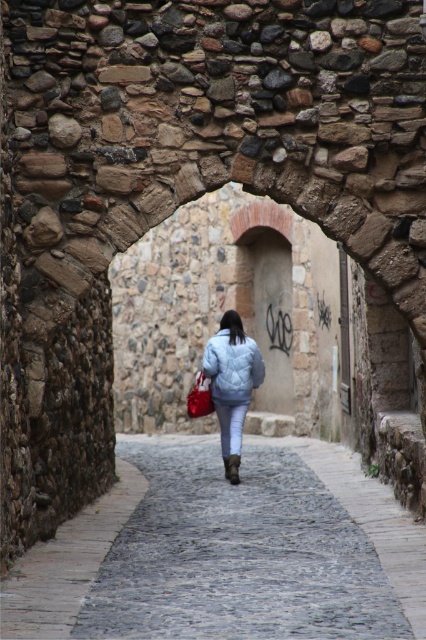
Between point (226, 340) and point (198, 403), which one is positioned behind?

The point (198, 403) is more distant.

Does matte blue jacket at center have a lesser width compared to matte red shopping bag at center?

Incorrect, matte blue jacket at center's width is not less than matte red shopping bag at center's.

Is point (232, 413) positioned before point (195, 406)?

Yes, point (232, 413) is closer to viewer.

Where is `matte blue jacket at center`? The width and height of the screenshot is (426, 640). matte blue jacket at center is located at coordinates (232, 384).

Can you confirm if matte blue jacket at center is positioned to the right of light blue quilted jacket at center?

Indeed, matte blue jacket at center is positioned on the right side of light blue quilted jacket at center.

Who is more forward, (227, 342) or (218, 403)?

Positioned in front is point (227, 342).

The height and width of the screenshot is (640, 426). In order to click on matte blue jacket at center in this screenshot , I will do `click(232, 384)`.

Is the position of light blue quilted jacket at center more distant than that of matte red shopping bag at center?

No, it is in front of matte red shopping bag at center.

Who is positioned more to the left, light blue quilted jacket at center or matte red shopping bag at center?

From the viewer's perspective, matte red shopping bag at center appears more on the left side.

Who is more forward, (256,358) or (192,388)?

Point (256,358) is more forward.

Find the location of `light blue quilted jacket at center`. light blue quilted jacket at center is located at coordinates (232, 368).